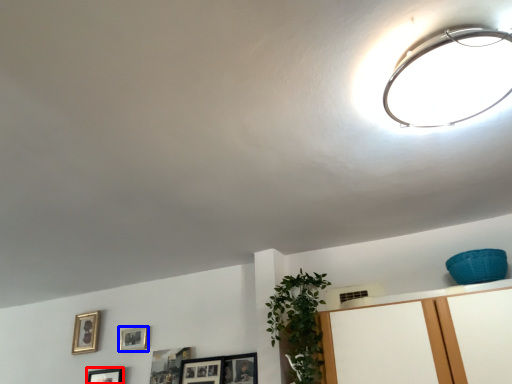
Question: Among these objects, which one is farthest to the camera, picture frame (highlighted by a red box) or picture frame (highlighted by a blue box)?

Choices:
 (A) picture frame
 (B) picture frame

Answer: (B)